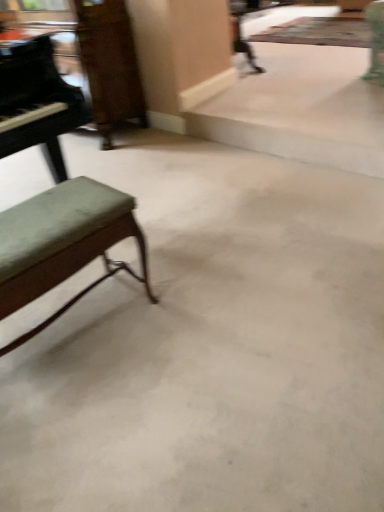
This screenshot has height=512, width=384. What do you see at coordinates (62, 243) in the screenshot?
I see `green fabric stool at lower left` at bounding box center [62, 243].

You are a GUI agent. You are given a task and a screenshot of the screen. Output one action in this format:
    pyautogui.click(x=<x>, y=<y>)
    Task: Click on the green fabric stool at lower left
    
    Given the screenshot: What is the action you would take?
    pyautogui.click(x=62, y=243)

Locate an element on the screen. This screenshot has width=384, height=512. green fabric stool at lower left is located at coordinates (62, 243).